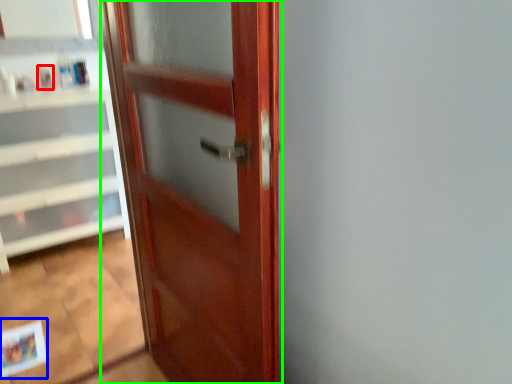
Question: Considering the real-world distances, which object is closest to toiletry (highlighted by a red box)? postcard (highlighted by a blue box) or door (highlighted by a green box).

Choices:
 (A) postcard
 (B) door

Answer: (A)